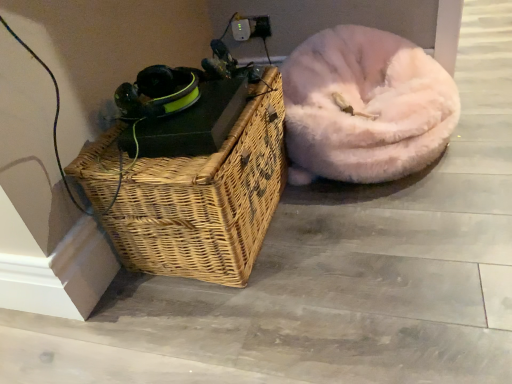
Question: In terms of height, does fuzzy pink dog bed at right look taller or shorter compared to woven wood picnic basket at lower left?

Choices:
 (A) short
 (B) tall

Answer: (A)

Question: Is fuzzy pink dog bed at right in front of or behind woven wood picnic basket at lower left in the image?

Choices:
 (A) front
 (B) behind

Answer: (B)

Question: From a real-world perspective, relative to woven wood picnic basket at lower left, is fuzzy pink dog bed at right vertically above or below?

Choices:
 (A) below
 (B) above

Answer: (A)

Question: From the image's perspective, is woven wood picnic basket at lower left above or below fuzzy pink dog bed at right?

Choices:
 (A) below
 (B) above

Answer: (A)

Question: Considering the positions of point (257, 97) and point (404, 77), is point (257, 97) closer or farther from the camera than point (404, 77)?

Choices:
 (A) closer
 (B) farther

Answer: (A)

Question: Considering the positions of woven wood picnic basket at lower left and fuzzy pink dog bed at right in the image, is woven wood picnic basket at lower left taller or shorter than fuzzy pink dog bed at right?

Choices:
 (A) short
 (B) tall

Answer: (B)

Question: Is woven wood picnic basket at lower left situated inside fuzzy pink dog bed at right or outside?

Choices:
 (A) outside
 (B) inside

Answer: (A)